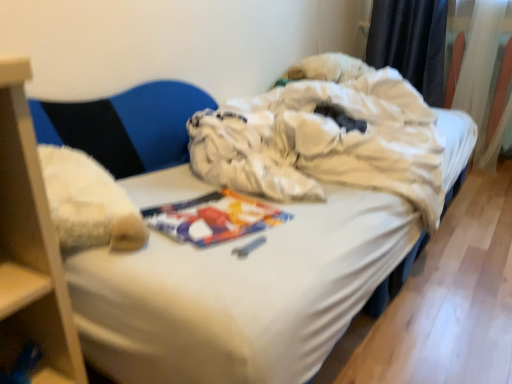
Question: From the image's perspective, is black fabric curtain at upper right, which is counted as the second curtain, starting from the right, under fuzzy fabric armchair at left?

Choices:
 (A) yes
 (B) no

Answer: (B)

Question: Is black fabric curtain at upper right, marked as the first curtain in a left-to-right arrangement, facing away from fuzzy fabric armchair at left?

Choices:
 (A) yes
 (B) no

Answer: (B)

Question: Can we say black fabric curtain at upper right, marked as the first curtain in a left-to-right arrangement, lies outside fuzzy fabric armchair at left?

Choices:
 (A) no
 (B) yes

Answer: (B)

Question: Is black fabric curtain at upper right, which is counted as the second curtain, starting from the right, not close to fuzzy fabric armchair at left?

Choices:
 (A) no
 (B) yes

Answer: (B)

Question: Does black fabric curtain at upper right, which is counted as the second curtain, starting from the right, lie behind fuzzy fabric armchair at left?

Choices:
 (A) yes
 (B) no

Answer: (A)

Question: Considering the relative positions of black fabric curtain at upper right, marked as the first curtain in a left-to-right arrangement, and fuzzy fabric armchair at left in the image provided, is black fabric curtain at upper right, marked as the first curtain in a left-to-right arrangement, to the left of fuzzy fabric armchair at left from the viewer's perspective?

Choices:
 (A) no
 (B) yes

Answer: (A)

Question: Does fuzzy fabric armchair at left touch black fabric curtain at upper right, marked as the first curtain in a left-to-right arrangement?

Choices:
 (A) yes
 (B) no

Answer: (B)

Question: Is fuzzy fabric armchair at left aimed at black fabric curtain at upper right, marked as the first curtain in a left-to-right arrangement?

Choices:
 (A) no
 (B) yes

Answer: (A)

Question: Considering the relative positions of fuzzy fabric armchair at left and black fabric curtain at upper right, which is counted as the second curtain, starting from the right, in the image provided, is fuzzy fabric armchair at left in front of black fabric curtain at upper right, which is counted as the second curtain, starting from the right,?

Choices:
 (A) no
 (B) yes

Answer: (B)

Question: Considering the relative sizes of fuzzy fabric armchair at left and black fabric curtain at upper right, which is counted as the second curtain, starting from the right, in the image provided, is fuzzy fabric armchair at left smaller than black fabric curtain at upper right, which is counted as the second curtain, starting from the right,?

Choices:
 (A) yes
 (B) no

Answer: (B)

Question: Can you confirm if fuzzy fabric armchair at left is shorter than black fabric curtain at upper right, which is counted as the second curtain, starting from the right?

Choices:
 (A) yes
 (B) no

Answer: (A)

Question: From a real-world perspective, is fuzzy fabric armchair at left below black fabric curtain at upper right, which is counted as the second curtain, starting from the right?

Choices:
 (A) yes
 (B) no

Answer: (A)

Question: Considering the relative sizes of white sheer curtain at upper right, the 2th curtain in the left-to-right sequence, and black fabric curtain at upper right, which is counted as the second curtain, starting from the right, in the image provided, is white sheer curtain at upper right, the 2th curtain in the left-to-right sequence, bigger than black fabric curtain at upper right, which is counted as the second curtain, starting from the right,?

Choices:
 (A) yes
 (B) no

Answer: (A)